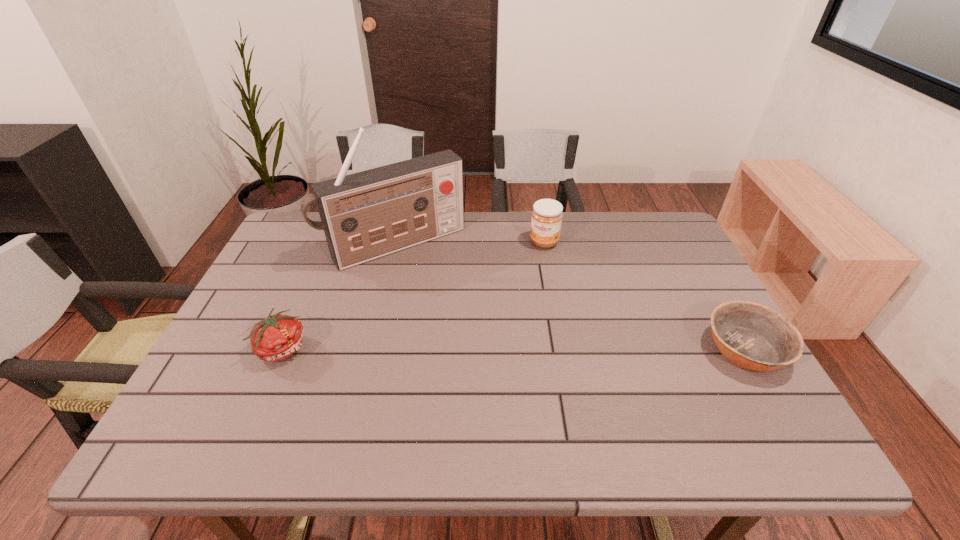
The image size is (960, 540). Find the location of `free region located 0.370m on the front label of the second object from right to left`. free region located 0.370m on the front label of the second object from right to left is located at coordinates (506, 338).

At what (x,y) coordinates should I click in order to perform the action: click on free space located 0.220m on the front panel of the tallest object. Please return your answer as a coordinate pair (x, y). The height and width of the screenshot is (540, 960). Looking at the image, I should click on (464, 315).

Locate an element on the screen. blank space located 0.350m on the front panel of the tallest object is located at coordinates (491, 349).

Where is `free spot located 0.230m on the front panel of the tallest object`? The width and height of the screenshot is (960, 540). free spot located 0.230m on the front panel of the tallest object is located at coordinates (466, 318).

Identify the location of jam that is at the far edge. (546, 220).

I want to click on radio receiver that is positioned at the far edge, so click(x=366, y=215).

Where is `object present at the near edge`? object present at the near edge is located at coordinates (754, 337).

What are the coordinates of `tomato present at the left edge` in the screenshot? It's located at (276, 338).

Where is `radio receiver that is at the left edge`? Image resolution: width=960 pixels, height=540 pixels. radio receiver that is at the left edge is located at coordinates (366, 215).

Image resolution: width=960 pixels, height=540 pixels. I want to click on object present at the right edge, so click(754, 337).